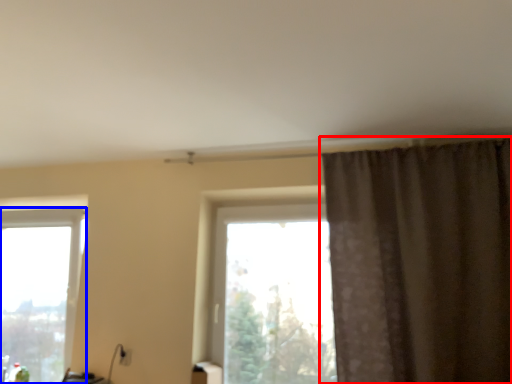
Question: Which point is further to the camera, curtain (highlighted by a red box) or window (highlighted by a blue box)?

Choices:
 (A) curtain
 (B) window

Answer: (B)